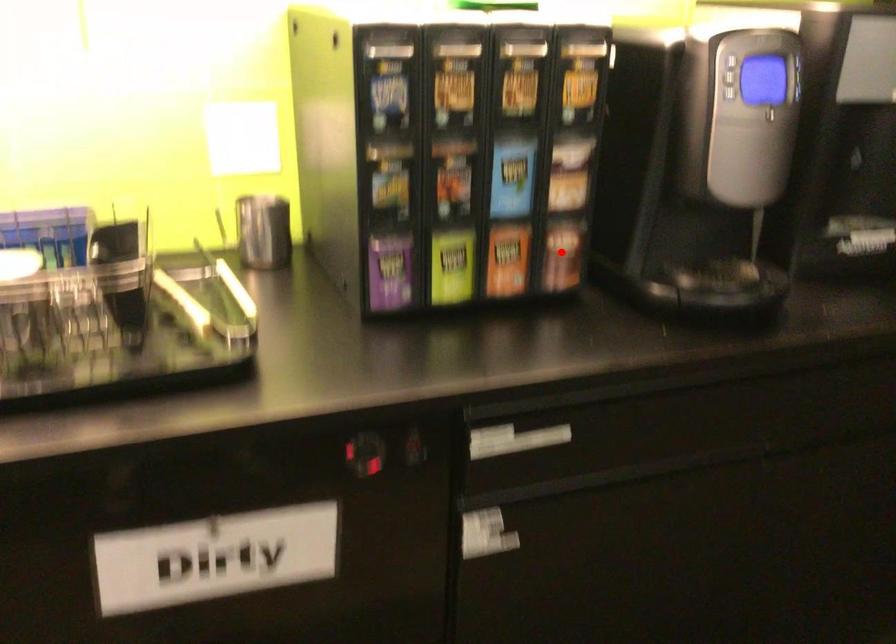
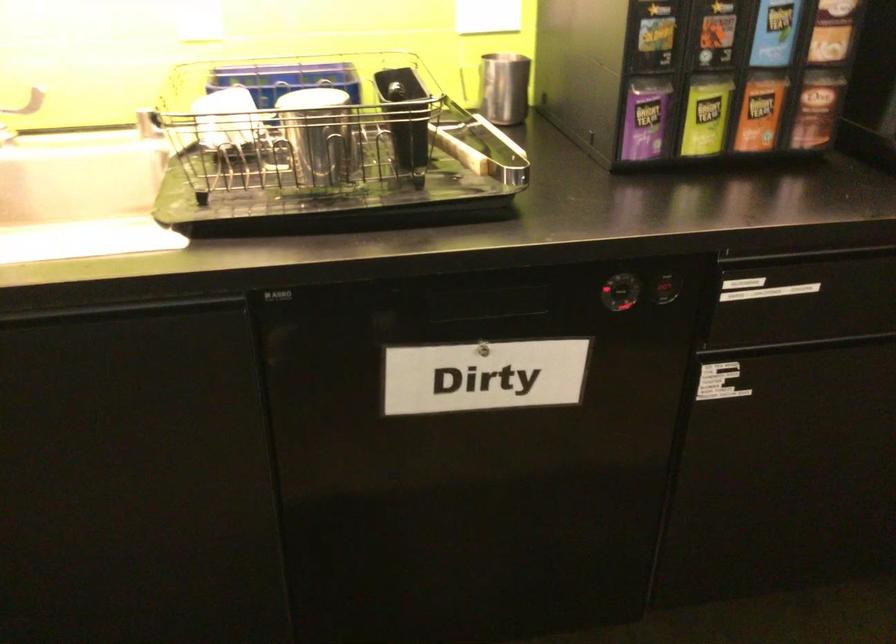
In the second image, find the point that corresponds to the highlighted location in the first image.

(816, 109)